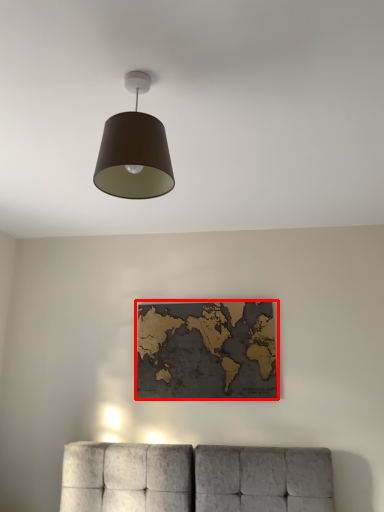
Question: Where is picture frame (annotated by the red box) located in relation to lamp in the image?

Choices:
 (A) left
 (B) right

Answer: (B)